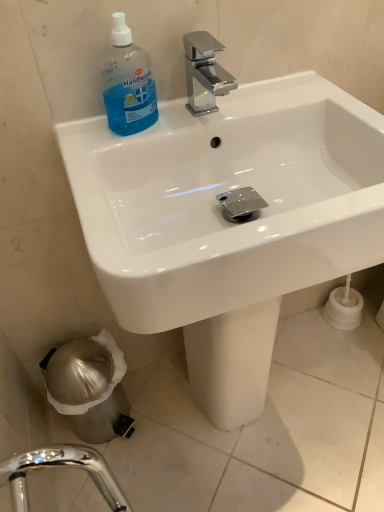
Measure the distance between point (163,222) and camera.

Point (163,222) is 28.66 inches from camera.

You are a GUI agent. You are given a task and a screenshot of the screen. Output one action in this format:
    pyautogui.click(x=<x>, y=<y>)
    Task: Click on the white glossy sink at upper center
    Image resolution: width=384 pixels, height=512 pixels.
    Given the screenshot: What is the action you would take?
    pyautogui.click(x=228, y=215)

Describe the element at coordinates (228, 215) in the screenshot. This screenshot has height=512, width=384. I see `white glossy sink at upper center` at that location.

Locate an element on the screen. The width and height of the screenshot is (384, 512). blue translucent plastic handwash at upper left is located at coordinates (128, 83).

The width and height of the screenshot is (384, 512). What do you see at coordinates (128, 83) in the screenshot? I see `blue translucent plastic handwash at upper left` at bounding box center [128, 83].

Image resolution: width=384 pixels, height=512 pixels. I want to click on white glossy sink at upper center, so click(228, 215).

Is blue translucent plastic handwash at upper left to the left or to the right of white glossy sink at upper center in the image?

Based on their positions, blue translucent plastic handwash at upper left is located to the left of white glossy sink at upper center.

Which object is more forward, blue translucent plastic handwash at upper left or white glossy sink at upper center?

white glossy sink at upper center is in front.

Considering the points (150, 81) and (166, 323), which point is in front, point (150, 81) or point (166, 323)?

The point (166, 323) is closer to the camera.

From the image's perspective, which is below, blue translucent plastic handwash at upper left or white glossy sink at upper center?

white glossy sink at upper center.

From a real-world perspective, relative to white glossy sink at upper center, is blue translucent plastic handwash at upper left vertically above or below?

blue translucent plastic handwash at upper left is situated higher than white glossy sink at upper center in the real world.

Considering the relative sizes of blue translucent plastic handwash at upper left and white glossy sink at upper center in the image provided, is blue translucent plastic handwash at upper left thinner than white glossy sink at upper center?

Correct, the width of blue translucent plastic handwash at upper left is less than that of white glossy sink at upper center.

Between blue translucent plastic handwash at upper left and white glossy sink at upper center, which one has more height?

white glossy sink at upper center.

Which of these two, blue translucent plastic handwash at upper left or white glossy sink at upper center, is bigger?

Result: Bigger between the two is white glossy sink at upper center.

Which is correct: blue translucent plastic handwash at upper left is inside white glossy sink at upper center, or outside of it?

blue translucent plastic handwash at upper left is located inside white glossy sink at upper center.

Is blue translucent plastic handwash at upper left not close to white glossy sink at upper center?

No, blue translucent plastic handwash at upper left is not far from white glossy sink at upper center.

Could you tell me if blue translucent plastic handwash at upper left is turned towards white glossy sink at upper center?

Yes, blue translucent plastic handwash at upper left is oriented towards white glossy sink at upper center.

The image size is (384, 512). I want to click on sink to the right of blue translucent plastic handwash at upper left, so click(x=228, y=215).

Which object is positioned more to the left, white glossy sink at upper center or blue translucent plastic handwash at upper left?

From the viewer's perspective, blue translucent plastic handwash at upper left appears more on the left side.

Is white glossy sink at upper center behind blue translucent plastic handwash at upper left?

No, the depth of white glossy sink at upper center is less than that of blue translucent plastic handwash at upper left.

Does point (372, 243) appear closer or farther from the camera than point (121, 63)?

Point (372, 243) is closer to the camera than point (121, 63).

From the image's perspective, which is above, white glossy sink at upper center or blue translucent plastic handwash at upper left?

From the image's view, blue translucent plastic handwash at upper left is above.

From a real-world perspective, who is located lower, white glossy sink at upper center or blue translucent plastic handwash at upper left?

From a 3D spatial view, white glossy sink at upper center is below.

Considering the relative sizes of white glossy sink at upper center and blue translucent plastic handwash at upper left in the image provided, is white glossy sink at upper center thinner than blue translucent plastic handwash at upper left?

Incorrect, the width of white glossy sink at upper center is not less than that of blue translucent plastic handwash at upper left.

Considering the relative sizes of white glossy sink at upper center and blue translucent plastic handwash at upper left in the image provided, is white glossy sink at upper center shorter than blue translucent plastic handwash at upper left?

In fact, white glossy sink at upper center may be taller than blue translucent plastic handwash at upper left.

Can you confirm if white glossy sink at upper center is smaller than blue translucent plastic handwash at upper left?

Incorrect, white glossy sink at upper center is not smaller in size than blue translucent plastic handwash at upper left.

Can we say white glossy sink at upper center lies outside blue translucent plastic handwash at upper left?

white glossy sink at upper center lies outside blue translucent plastic handwash at upper left's area.

Is white glossy sink at upper center far from blue translucent plastic handwash at upper left?

white glossy sink at upper center is near blue translucent plastic handwash at upper left, not far away.

Is blue translucent plastic handwash at upper left at the back of white glossy sink at upper center?

Yes, white glossy sink at upper center's orientation is away from blue translucent plastic handwash at upper left.

The height and width of the screenshot is (512, 384). I want to click on cleaning product above the white glossy sink at upper center (from the image's perspective), so click(128, 83).

I want to click on sink below the blue translucent plastic handwash at upper left (from a real-world perspective), so click(x=228, y=215).

Locate an element on the screen. This screenshot has width=384, height=512. cleaning product positioned vertically above the white glossy sink at upper center (from a real-world perspective) is located at coordinates (128, 83).